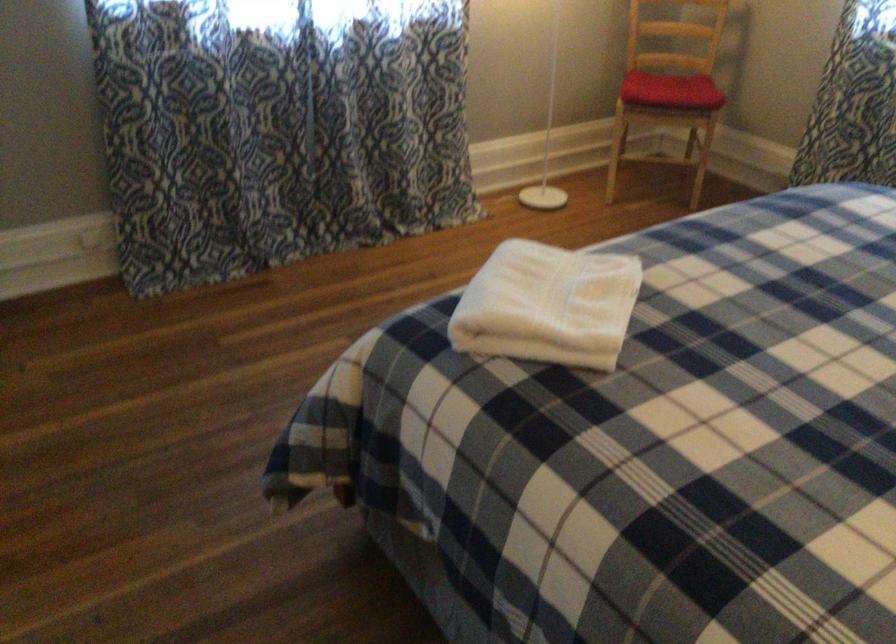
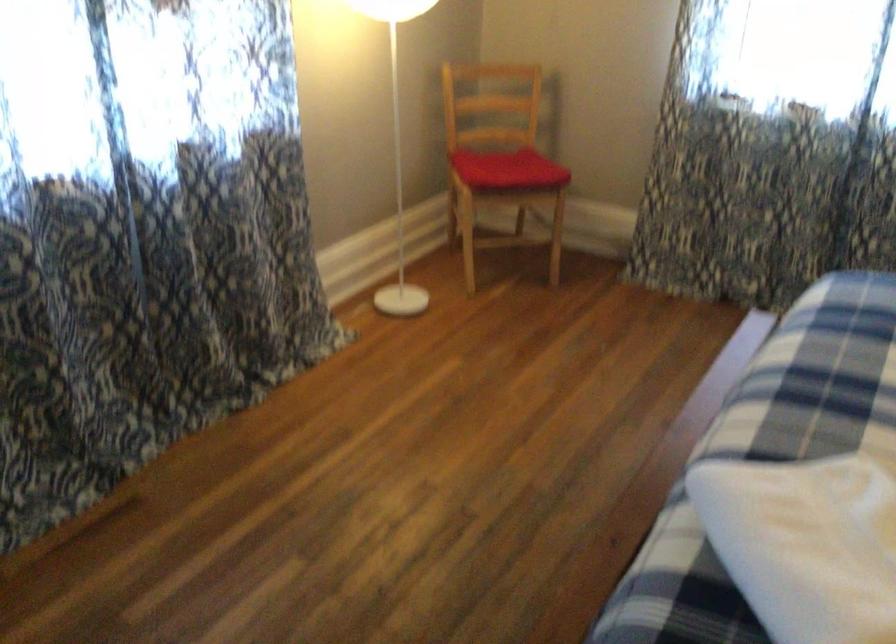
Question: Based on the continuous images, in which direction is the camera rotating? Reply with the corresponding letter.

Choices:
 (A) Left
 (B) Right
 (C) Up
 (D) Down

Answer: (B)